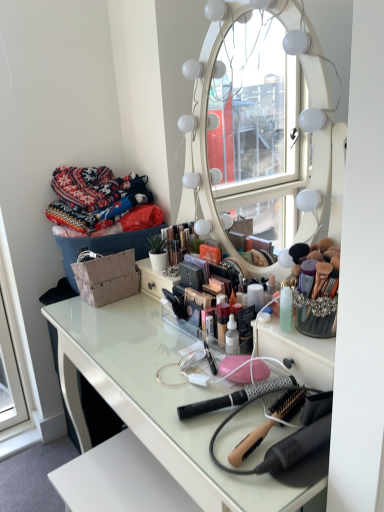
What are the coordinates of `empty space that is ontop of white glossy table at center` in the screenshot? It's located at (155, 348).